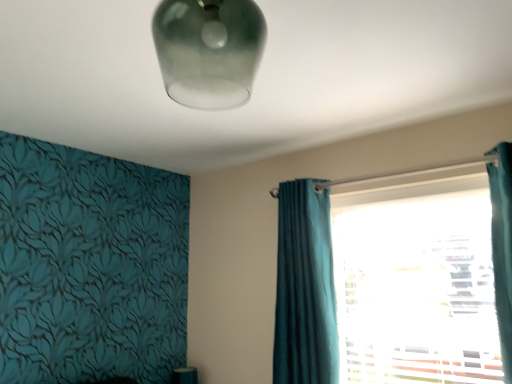
Question: Can you confirm if teal fabric curtain at right is smaller than frosted glass lampshade at upper center?

Choices:
 (A) no
 (B) yes

Answer: (A)

Question: Is teal fabric curtain at right closer to camera compared to frosted glass lampshade at upper center?

Choices:
 (A) yes
 (B) no

Answer: (B)

Question: From the image's perspective, is teal fabric curtain at right above frosted glass lampshade at upper center?

Choices:
 (A) no
 (B) yes

Answer: (A)

Question: Is frosted glass lampshade at upper center a part of teal fabric curtain at right?

Choices:
 (A) no
 (B) yes

Answer: (A)

Question: Does teal fabric curtain at right lie behind frosted glass lampshade at upper center?

Choices:
 (A) no
 (B) yes

Answer: (B)

Question: In the image, is teal fabric curtain at right positioned in front of or behind teal velvet curtain at center?

Choices:
 (A) front
 (B) behind

Answer: (A)

Question: Considering the relative positions of teal fabric curtain at right and teal velvet curtain at center in the image provided, is teal fabric curtain at right to the left or to the right of teal velvet curtain at center?

Choices:
 (A) right
 (B) left

Answer: (A)

Question: From the image's perspective, is teal fabric curtain at right positioned above or below teal velvet curtain at center?

Choices:
 (A) below
 (B) above

Answer: (B)

Question: Considering the positions of teal fabric curtain at right and teal velvet curtain at center in the image, is teal fabric curtain at right wider or thinner than teal velvet curtain at center?

Choices:
 (A) thin
 (B) wide

Answer: (B)

Question: Visually, is frosted glass lampshade at upper center positioned to the left or to the right of teal velvet curtain at center?

Choices:
 (A) right
 (B) left

Answer: (B)

Question: Does point (265, 36) appear closer or farther from the camera than point (289, 240)?

Choices:
 (A) farther
 (B) closer

Answer: (B)

Question: From a real-world perspective, is frosted glass lampshade at upper center above or below teal velvet curtain at center?

Choices:
 (A) below
 (B) above

Answer: (B)

Question: Considering their positions, is frosted glass lampshade at upper center located in front of or behind teal velvet curtain at center?

Choices:
 (A) behind
 (B) front

Answer: (B)

Question: Is teal velvet curtain at center taller or shorter than teal fabric curtain at right?

Choices:
 (A) short
 (B) tall

Answer: (A)

Question: In the image, is teal velvet curtain at center on the left side or the right side of teal fabric curtain at right?

Choices:
 (A) right
 (B) left

Answer: (B)